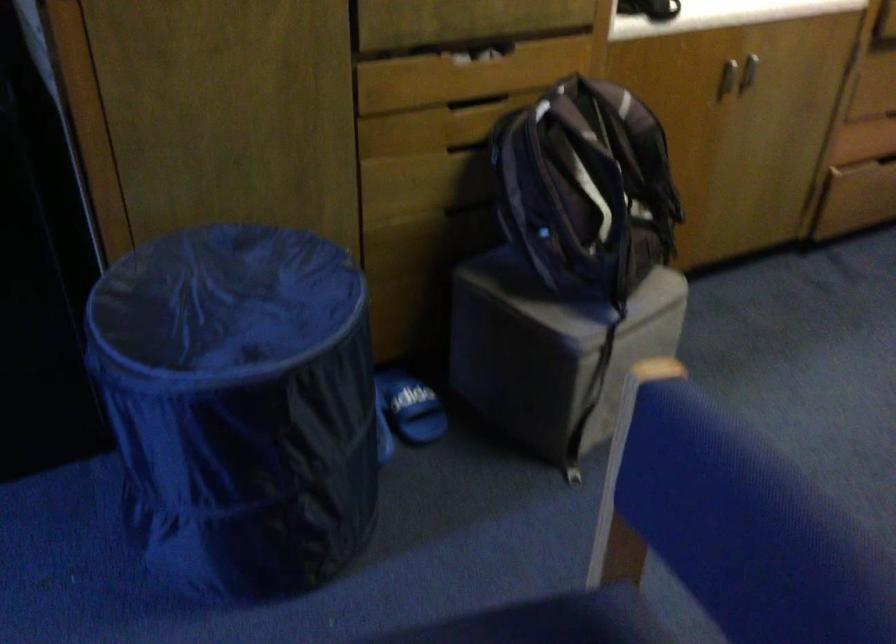
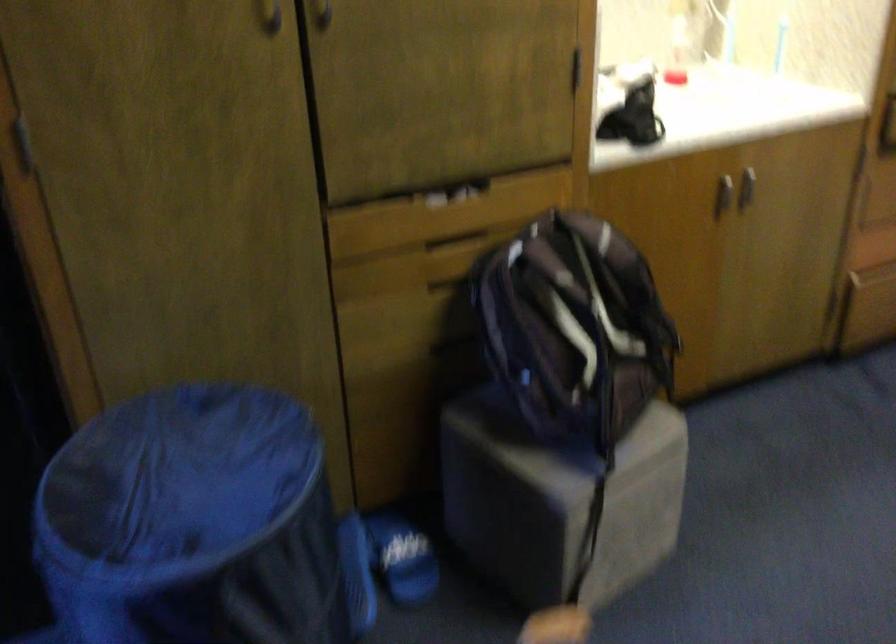
Find the pixel in the second image that matches (623,172) in the first image.

(607, 310)